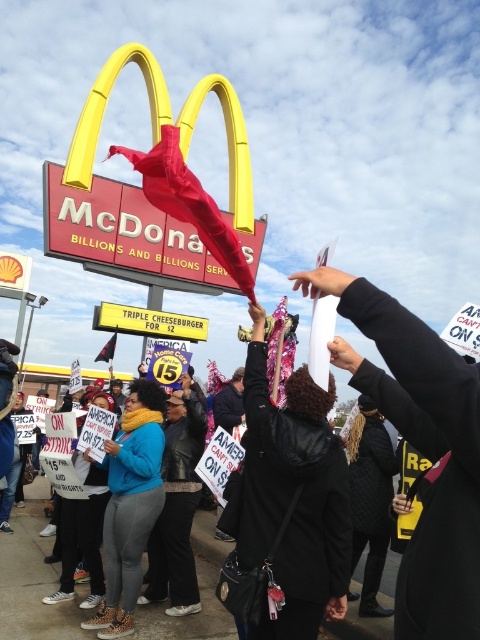
You are standing at the location of the viewer in the protest scene outside McDonalds. You want to throw a paper airplane to reach the black fabric hat at upper center. The paper airplane can fly up to 50 meters. Will it be able to reach the hat?

The black fabric hat at upper center and viewer are 50.16 meters apart, so the paper airplane can only fly up to 50 meters. Therefore, it cannot reach the hat.

You are a photographer trying to capture a clear shot of the blue fleece jacket at center and the black fabric hat at upper center. Based on their positions, which object should you focus on first to ensure both are in frame?

The black fabric hat at upper center is located above the blue fleece jacket at center, so you should focus on the black fabric hat at upper center first to ensure both are in frame.